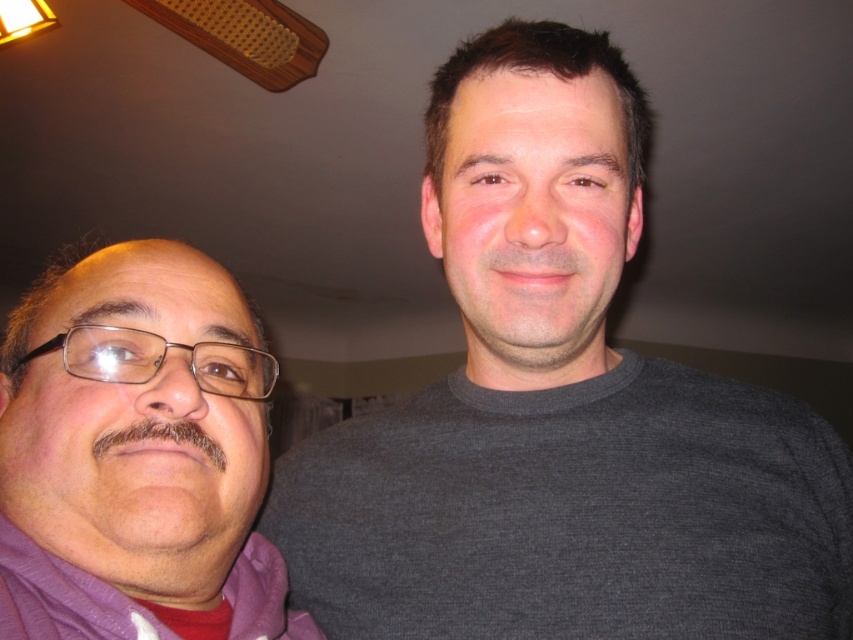
Where is `gray matte sweater at center`? This screenshot has height=640, width=853. gray matte sweater at center is located at coordinates (560, 410).

Does point (494, 186) come closer to viewer compared to point (129, 413)?

No, it is behind (129, 413).

This screenshot has height=640, width=853. I want to click on gray matte sweater at center, so click(560, 410).